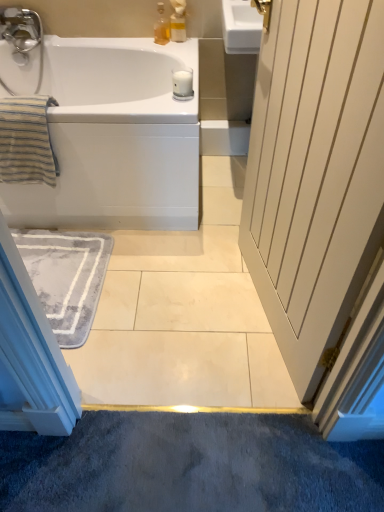
Question: Is white glossy bathtub at upper left at the right side of gray soft rug at lower left?

Choices:
 (A) no
 (B) yes

Answer: (B)

Question: Considering the relative sizes of white glossy bathtub at upper left and gray soft rug at lower left in the image provided, is white glossy bathtub at upper left thinner than gray soft rug at lower left?

Choices:
 (A) yes
 (B) no

Answer: (B)

Question: Is white glossy bathtub at upper left outside of gray soft rug at lower left?

Choices:
 (A) yes
 (B) no

Answer: (A)

Question: Does white glossy bathtub at upper left have a smaller size compared to gray soft rug at lower left?

Choices:
 (A) no
 (B) yes

Answer: (A)

Question: Would you consider white glossy bathtub at upper left to be distant from gray soft rug at lower left?

Choices:
 (A) no
 (B) yes

Answer: (A)

Question: Is white glossy bathtub at upper left behind gray soft rug at lower left?

Choices:
 (A) no
 (B) yes

Answer: (A)

Question: Is gray soft rug at lower left taller than translucent plastic bottle at upper center?

Choices:
 (A) no
 (B) yes

Answer: (A)

Question: Can you confirm if gray soft rug at lower left is positioned to the right of translucent plastic bottle at upper center?

Choices:
 (A) yes
 (B) no

Answer: (B)

Question: From the image's perspective, is gray soft rug at lower left above translucent plastic bottle at upper center?

Choices:
 (A) no
 (B) yes

Answer: (A)

Question: Is gray soft rug at lower left positioned with its back to translucent plastic bottle at upper center?

Choices:
 (A) no
 (B) yes

Answer: (A)

Question: Does gray soft rug at lower left come in front of translucent plastic bottle at upper center?

Choices:
 (A) yes
 (B) no

Answer: (A)

Question: Is gray soft rug at lower left further to the viewer compared to translucent plastic bottle at upper center?

Choices:
 (A) no
 (B) yes

Answer: (A)

Question: Is white glossy bathtub at upper left next to translucent plastic soap dispenser at upper center and touching it?

Choices:
 (A) no
 (B) yes

Answer: (A)